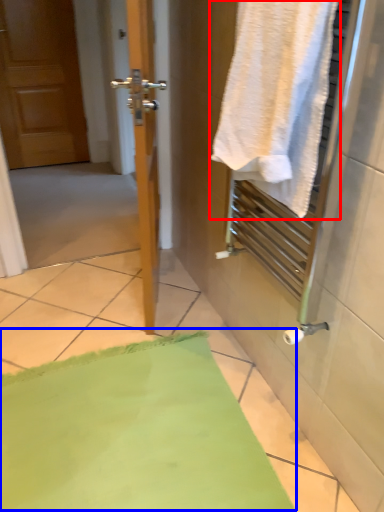
Question: Which object appears closest to the camera in this image, towel (highlighted by a red box) or bath mat (highlighted by a blue box)?

Choices:
 (A) towel
 (B) bath mat

Answer: (A)